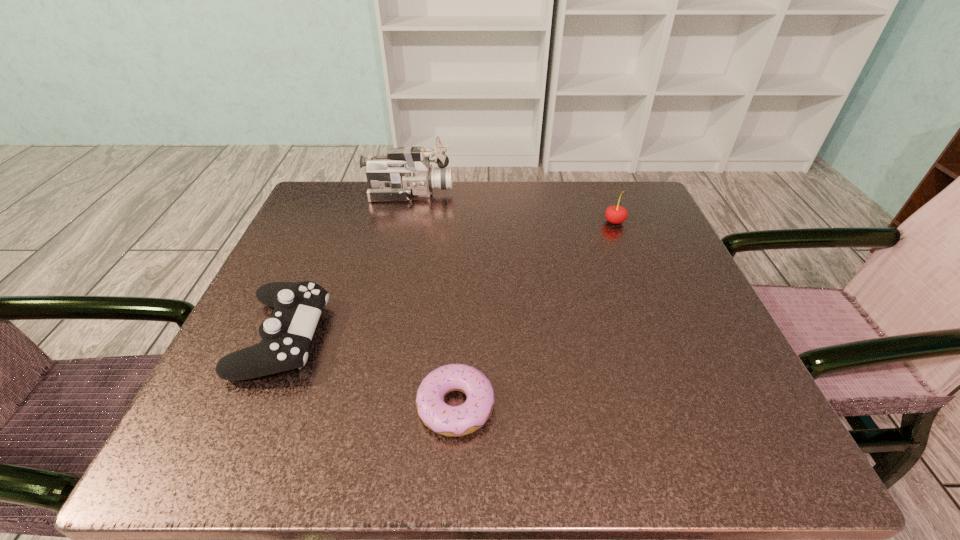
The image size is (960, 540). What are the coordinates of `the tallest object` in the screenshot? It's located at click(x=405, y=173).

At what (x,y) coordinates should I click in order to perform the action: click on camcorder. Please return your answer as a coordinate pair (x, y). The height and width of the screenshot is (540, 960). Looking at the image, I should click on [405, 173].

Locate an element on the screen. This screenshot has width=960, height=540. cherry is located at coordinates (614, 214).

Image resolution: width=960 pixels, height=540 pixels. Identify the location of the third nearest object. (614, 214).

Where is `the second shortest object`? Image resolution: width=960 pixels, height=540 pixels. the second shortest object is located at coordinates (286, 335).

The width and height of the screenshot is (960, 540). Identify the location of doughnut. (452, 421).

This screenshot has width=960, height=540. Find the location of `blank area located 0.290m on the front-facing side of the camcorder`. blank area located 0.290m on the front-facing side of the camcorder is located at coordinates (570, 193).

You are a GUI agent. You are given a task and a screenshot of the screen. Output one action in this format:
    pyautogui.click(x=<x>, y=<y>)
    Task: Click on the free region located 0.340m on the left of the third shortest object
    This screenshot has height=540, width=960.
    Given the screenshot: What is the action you would take?
    pyautogui.click(x=452, y=222)

Locate an element on the screen. The height and width of the screenshot is (540, 960). free spot located on the surface of the control is located at coordinates (494, 336).

At what (x,y) coordinates should I click in order to perform the action: click on vacant area situated 0.150m on the right of the shortest object. Please return your answer as a coordinate pair (x, y). This screenshot has height=540, width=960. Looking at the image, I should click on (596, 405).